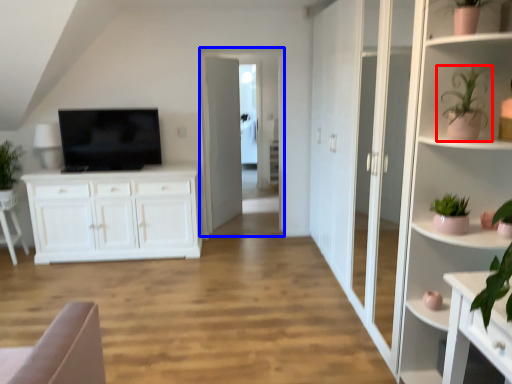
Question: Among these objects, which one is farthest to the camera, houseplant (highlighted by a red box) or glass door (highlighted by a blue box)?

Choices:
 (A) houseplant
 (B) glass door

Answer: (B)